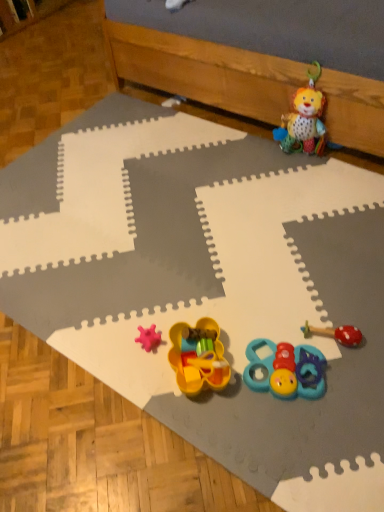
Identify the location of vacant area that is in front of teal rubber teething toy at lower center, the 3th toy when ordered from back to front. (304, 450).